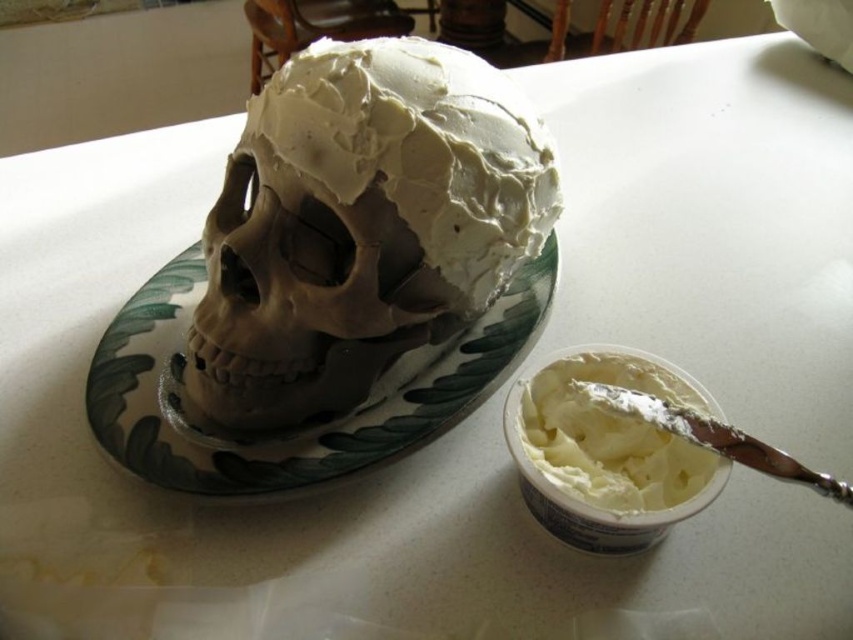
You are standing at the origin point in the image. Which direction should you move to reach the green leafy platter at center?

The green leafy platter at center is located at point 0.667 along the x axis and 0.368 along the y axis, so you should move to the right and slightly upwards to reach it.

You are a baker who needs to place a small candle on the tallest object in the scene. Which object should you choose between the matte clay skull at center and the green leafy platter at center?

The matte clay skull at center is taller than the green leafy platter at center, so you should place the candle on the matte clay skull at center.